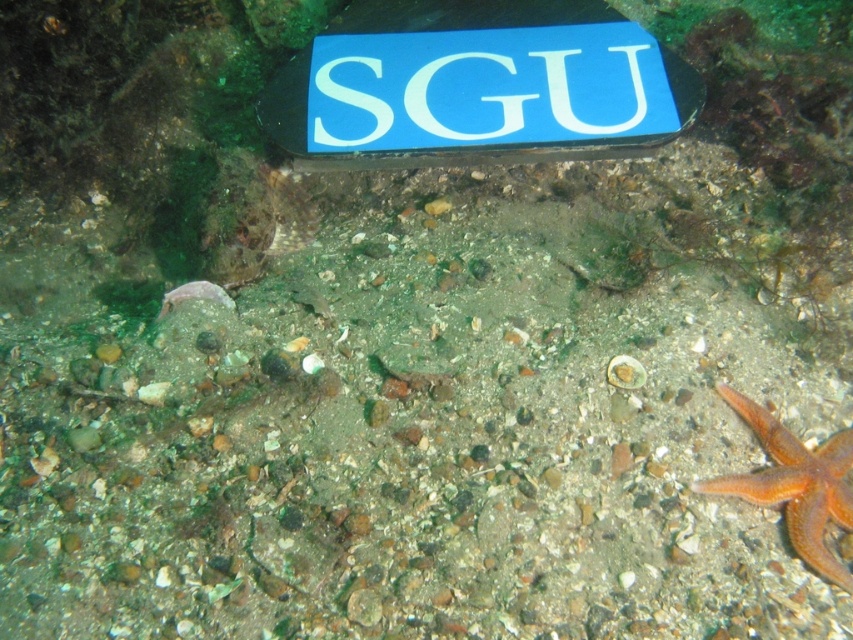
Question: Can you confirm if blue plastic sign at upper center is positioned below orange matte starfish at lower right?

Choices:
 (A) no
 (B) yes

Answer: (A)

Question: Which point appears closest to the camera in this image?

Choices:
 (A) (750, 484)
 (B) (271, 113)

Answer: (A)

Question: Can you confirm if blue plastic sign at upper center is positioned above orange matte starfish at lower right?

Choices:
 (A) yes
 (B) no

Answer: (A)

Question: Is blue plastic sign at upper center thinner than orange matte starfish at lower right?

Choices:
 (A) no
 (B) yes

Answer: (A)